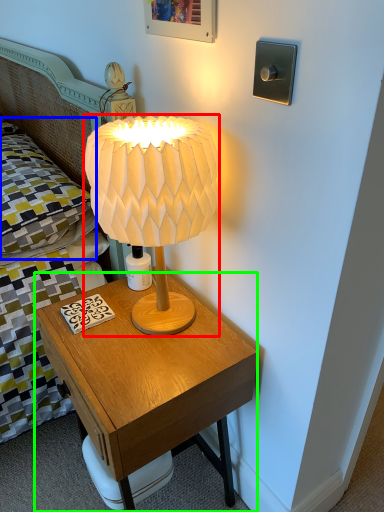
Question: Considering the real-world distances, which object is farthest from lamp (highlighted by a red box)? pillow (highlighted by a blue box) or nightstand (highlighted by a green box)?

Choices:
 (A) pillow
 (B) nightstand

Answer: (A)